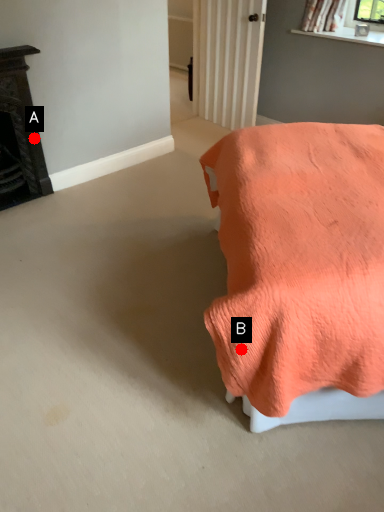
Question: Two points are circled on the image, labeled by A and B beside each circle. Which point is farther from the camera taking this photo?

Choices:
 (A) A is further
 (B) B is further

Answer: (A)